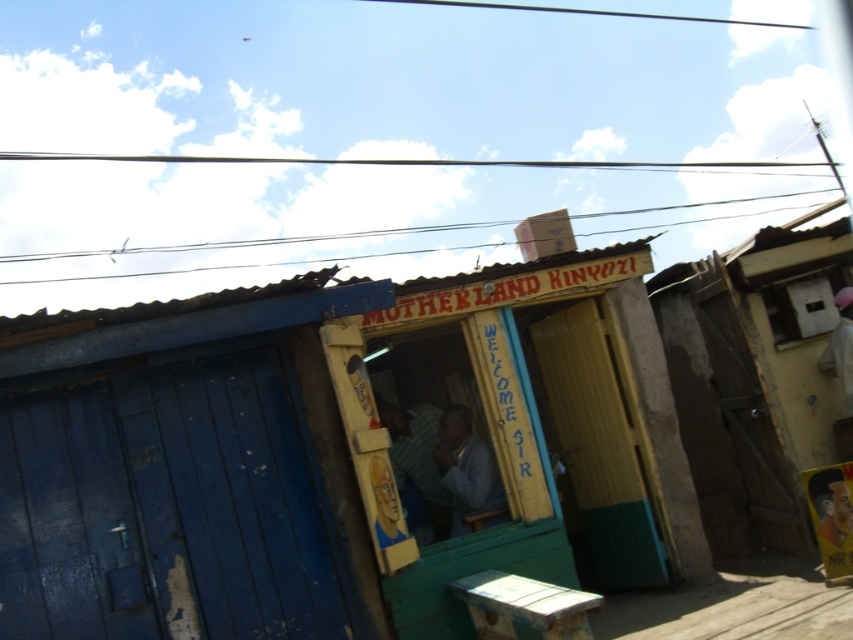
You are a customer standing outside the storefront and want to enter the building. Which structure should you approach if you want to enter the building through the door? Please choose between the wooden hut at center and the brown corrugated metal hut at center.

The wooden hut at center has a door, so you should approach the wooden hut at center to enter the building.

You are a customer entering the storefront and notice the wooden hut at center and the light blue fabric at center. Which object is positioned higher from the ground?

The wooden hut at center is above the light blue fabric at center, so it is positioned higher from the ground.

Based on the photo, you are a customer entering the store and notice the brown corrugated metal hut at center and the light blue fabric at center. Which object is positioned higher from the ground?

The brown corrugated metal hut at center is above the light blue fabric at center, so it is higher from the ground.